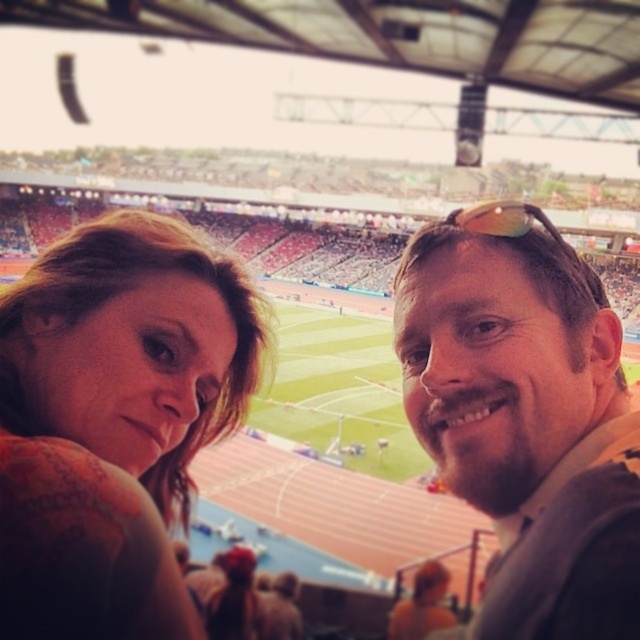
You are standing at the center of the stadium field. You see a point marked at coordinates (115, 419). What object is located at that point?

The point at coordinates (115, 419) corresponds to the matte orange shirt at left.